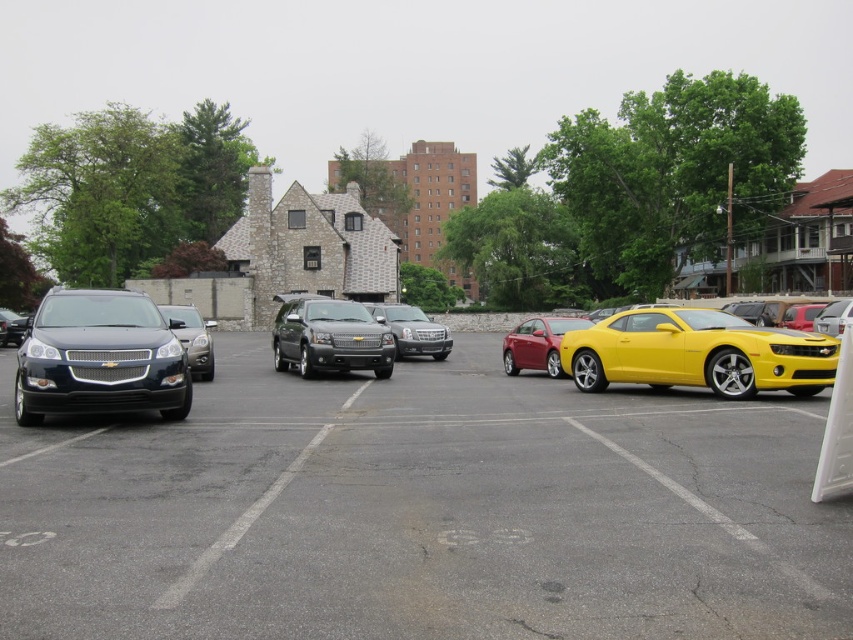
Question: Which object is farther from the camera taking this photo?

Choices:
 (A) satin silver suv at center
 (B) matte black suv at left

Answer: (A)

Question: Which of the following is the closest to the observer?

Choices:
 (A) (35, 404)
 (B) (532, 328)

Answer: (A)

Question: Which of the following is the farthest from the observer?

Choices:
 (A) (373, 557)
 (B) (364, 358)
 (C) (200, 316)

Answer: (C)

Question: Is yellow metallic car at center-right below shiny black sedan at left?

Choices:
 (A) yes
 (B) no

Answer: (B)

Question: From the image, what is the correct spatial relationship of satin silver suv at center in relation to yellow metallic car at center-right?

Choices:
 (A) right
 (B) left

Answer: (B)

Question: Is yellow matte car at center positioned at the back of yellow metallic car at center-right?

Choices:
 (A) yes
 (B) no

Answer: (B)